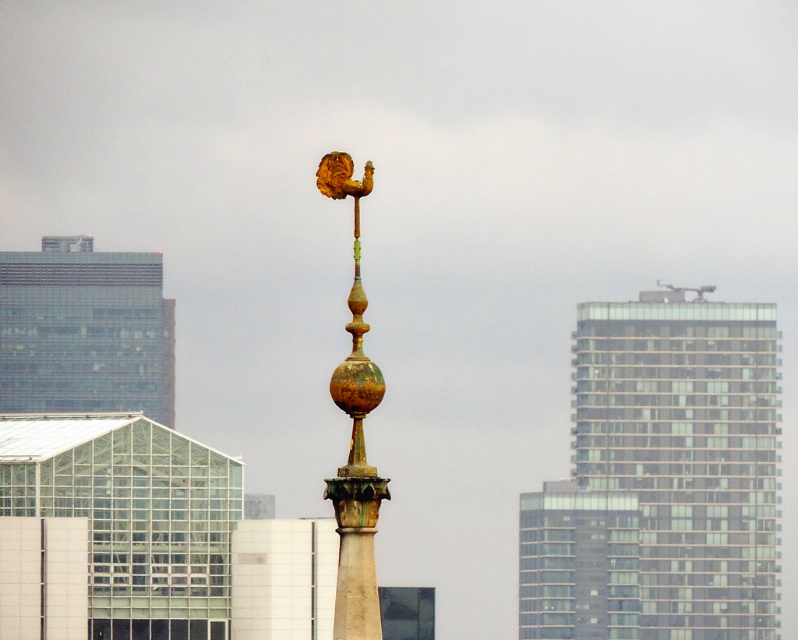
Is glassy concrete skyscraper at upper right shorter than glassy reflective building at left?

Incorrect, glassy concrete skyscraper at upper right's height does not fall short of glassy reflective building at left's.

This screenshot has height=640, width=798. What do you see at coordinates (662, 477) in the screenshot? I see `glassy concrete skyscraper at upper right` at bounding box center [662, 477].

Is point (757, 618) positioned in front of point (58, 333)?

No, it is not.

Where is `glassy concrete skyscraper at upper right`? This screenshot has height=640, width=798. glassy concrete skyscraper at upper right is located at coordinates (662, 477).

Does glassy reflective building at left have a smaller size compared to gold/green patina spire at center?

Yes, glassy reflective building at left is smaller than gold/green patina spire at center.

Can you confirm if glassy reflective building at left is wider than gold/green patina spire at center?

Yes, glassy reflective building at left is wider than gold/green patina spire at center.

Describe the element at coordinates (85, 330) in the screenshot. I see `glassy reflective building at left` at that location.

Locate an element on the screen. The image size is (798, 640). glassy reflective building at left is located at coordinates (85, 330).

Who is positioned more to the right, glassy concrete skyscraper at upper right or gold/green patina spire at center?

glassy concrete skyscraper at upper right is more to the right.

Who is positioned more to the left, glassy concrete skyscraper at upper right or gold/green patina spire at center?

gold/green patina spire at center

Between point (642, 477) and point (382, 394), which one is positioned in front?

Point (382, 394)

What are the coordinates of `glassy concrete skyscraper at upper right` in the screenshot? It's located at (662, 477).